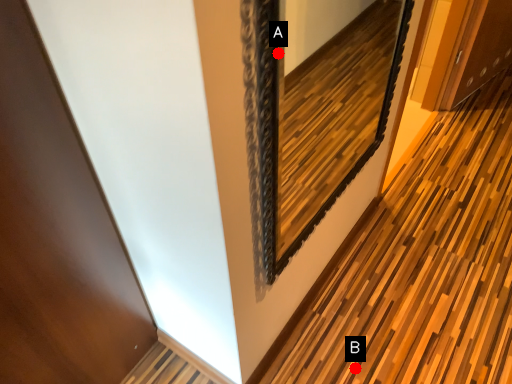
Question: Two points are circled on the image, labeled by A and B beside each circle. Among these points, which one is farthest from the camera?

Choices:
 (A) A is further
 (B) B is further

Answer: (A)